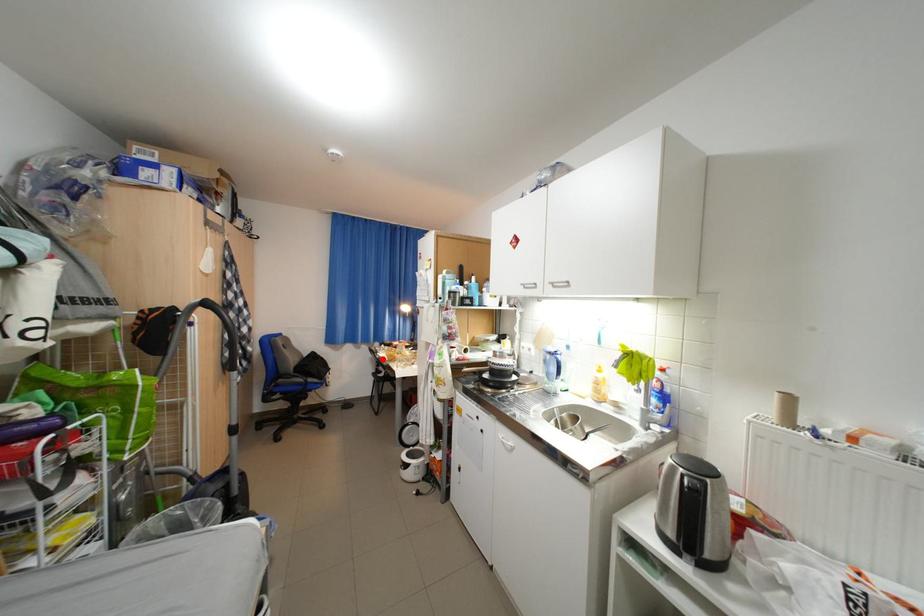
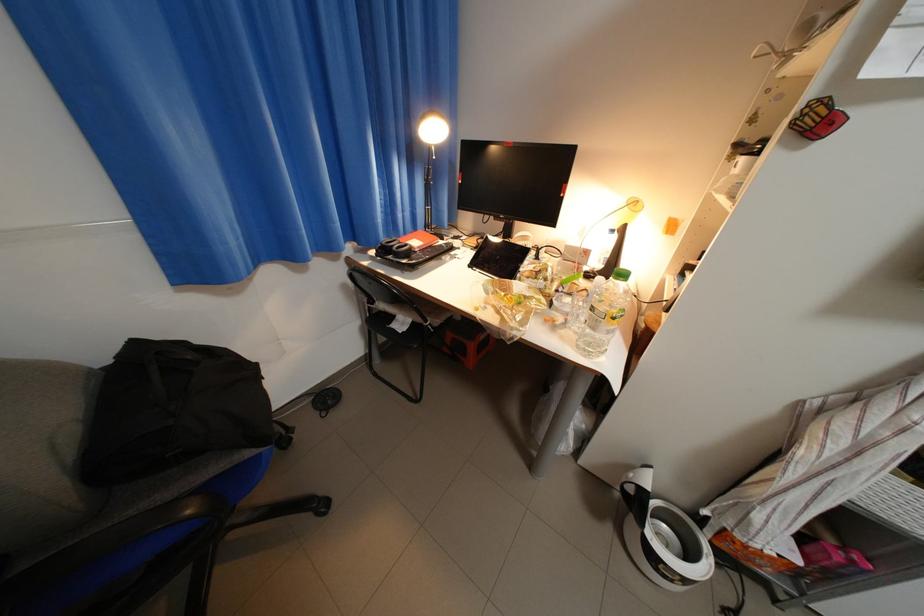
Question: I am providing you with two images of the same scene from different viewpoints. Image1 has a red point marked. In image2, the corresponding 3D location appears at what relative position? Reply with the corresponding letter.

Choices:
 (A) Closer
 (B) Farther

Answer: (A)